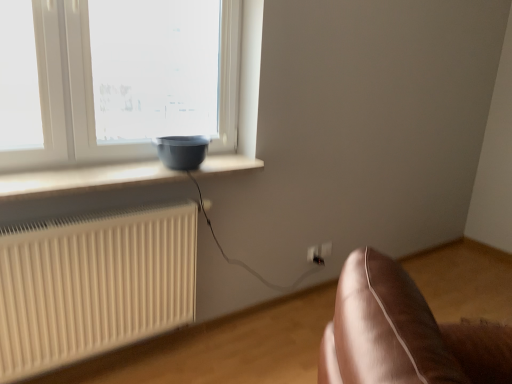
Where is `free location to the left of matte gray bowl at window`? free location to the left of matte gray bowl at window is located at coordinates (131, 166).